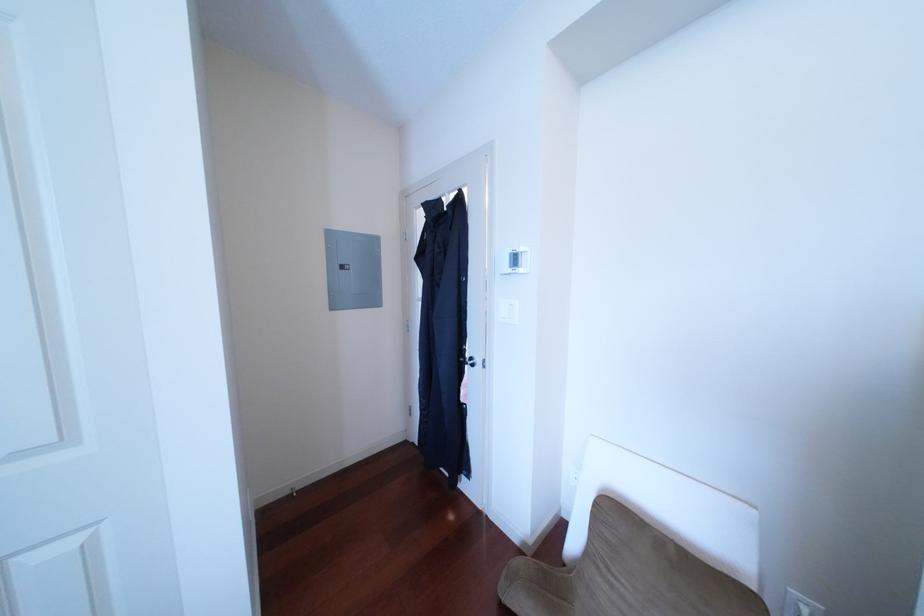
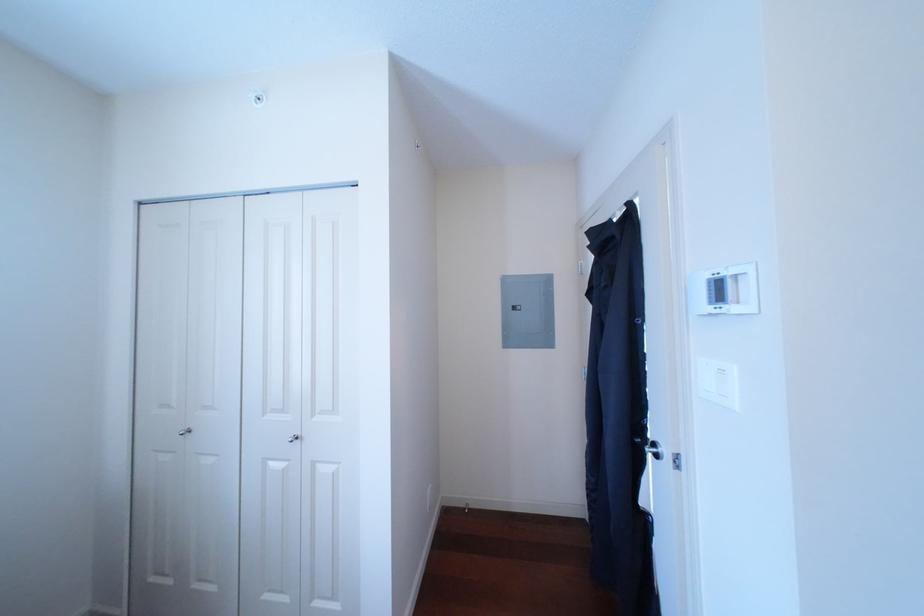
Question: The camera is either moving clockwise (left) or counter-clockwise (right) around the object. The first image is from the beginning of the video and the second image is from the end. Is the camera moving left or right when shooting the video?

Choices:
 (A) Left
 (B) Right

Answer: (B)